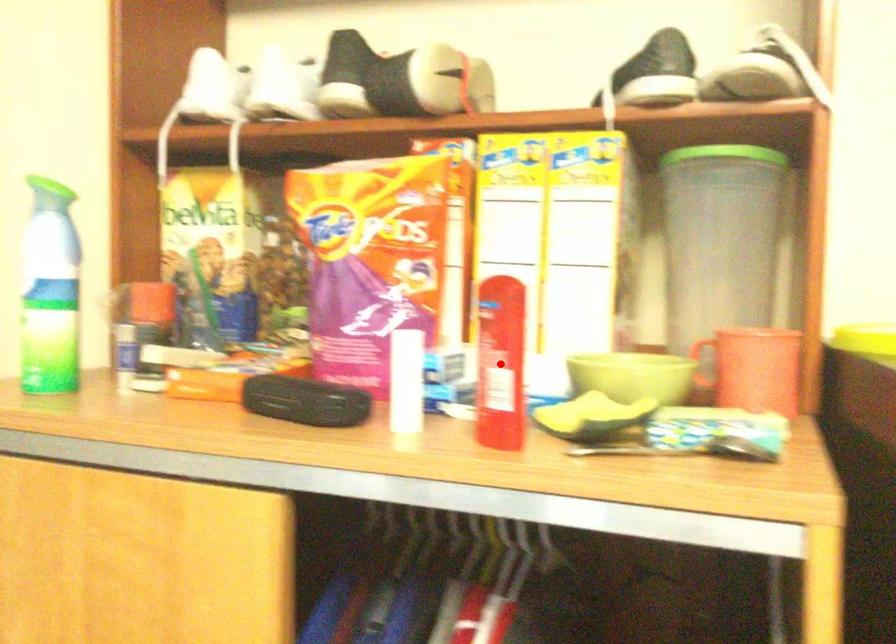
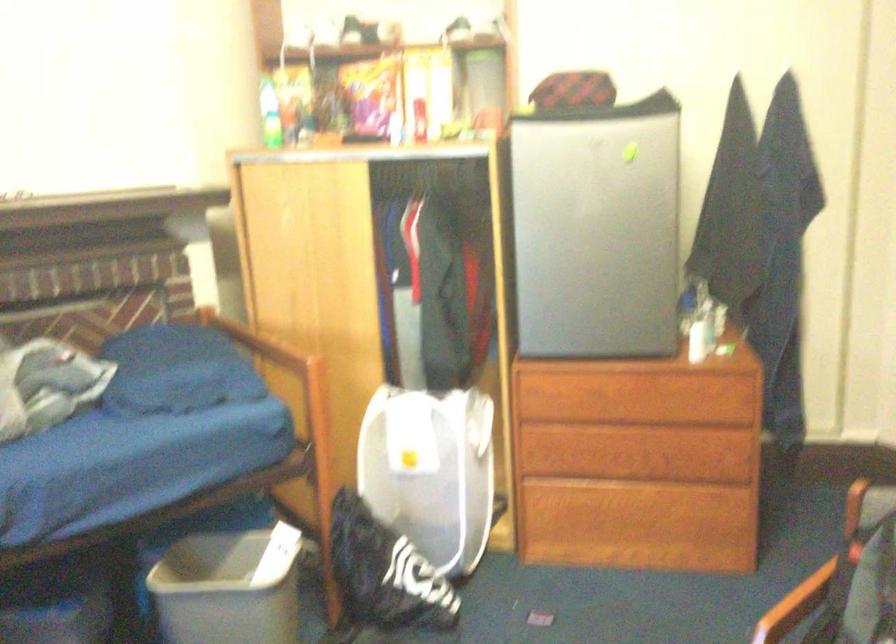
Question: I am providing you with two images of the same scene from different viewpoints. A red point is marked on the first image. Can you still see the location of the red point in image 2?

Choices:
 (A) Yes
 (B) No

Answer: (B)